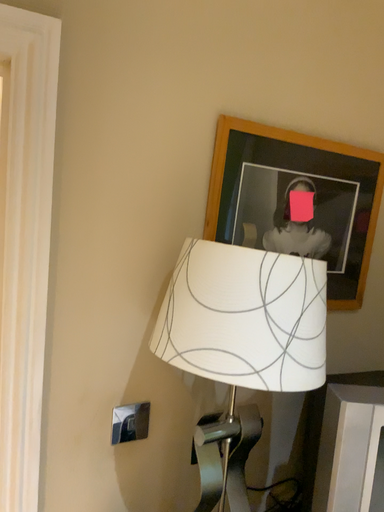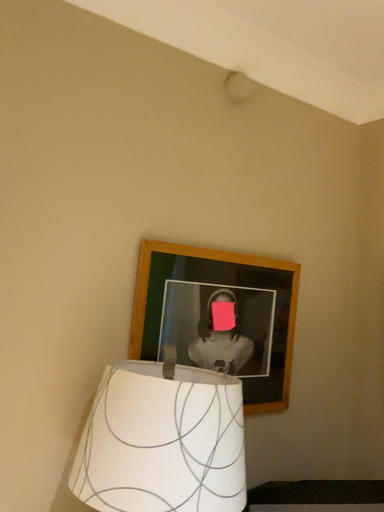
Question: How did the camera likely rotate when shooting the video?

Choices:
 (A) rotated right
 (B) rotated left

Answer: (A)